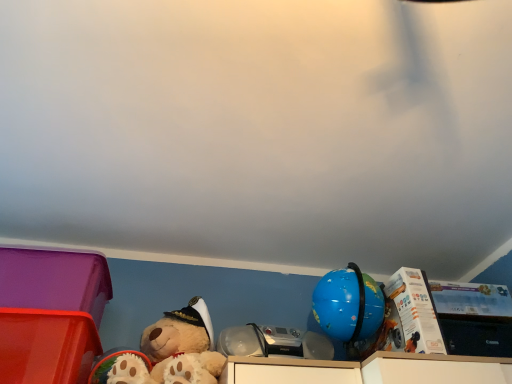
Identify the location of fluffy beige teddy bear at lower left. Image resolution: width=512 pixels, height=384 pixels. (174, 350).

What do you see at coordinates (474, 318) in the screenshot?
I see `white cardboard box at upper right, acting as the 1th storage box starting from the right` at bounding box center [474, 318].

Locate an element on the screen. fluffy beige teddy bear at lower left is located at coordinates (174, 350).

Is fluffy beige teddy bear at lower left wider than matte plastic storage box at lower left, the 1th storage box viewed from the left?

Yes.

Considering the sizes of objects fluffy beige teddy bear at lower left and matte plastic storage box at lower left, placed as the 3th storage box when sorted from right to left, in the image provided, who is smaller, fluffy beige teddy bear at lower left or matte plastic storage box at lower left, placed as the 3th storage box when sorted from right to left,?

matte plastic storage box at lower left, placed as the 3th storage box when sorted from right to left.

Is fluffy beige teddy bear at lower left closer to the viewer compared to matte plastic storage box at lower left, placed as the 3th storage box when sorted from right to left?

That is True.

Is white cardboard box at upper right, the 3th storage box viewed from the left, thinner than fluffy beige teddy bear at lower left?

Yes, white cardboard box at upper right, the 3th storage box viewed from the left, is thinner than fluffy beige teddy bear at lower left.

From a real-world perspective, is white cardboard box at upper right, acting as the 1th storage box starting from the right, positioned above or below fluffy beige teddy bear at lower left?

In terms of real-world spatial position, white cardboard box at upper right, acting as the 1th storage box starting from the right, is above fluffy beige teddy bear at lower left.

Does white cardboard box at upper right, acting as the 1th storage box starting from the right, have a lesser height compared to fluffy beige teddy bear at lower left?

Yes, white cardboard box at upper right, acting as the 1th storage box starting from the right, is shorter than fluffy beige teddy bear at lower left.

Locate an element on the screen. The height and width of the screenshot is (384, 512). storage box on the right of the matte plastic storage box at lower left, which is the second storage box from left to right is located at coordinates (474, 318).

Is white cardboard box at upper right, acting as the 1th storage box starting from the right, located outside matte plastic storage box at lower left, which is the second storage box from left to right?

That's correct, white cardboard box at upper right, acting as the 1th storage box starting from the right, is outside of matte plastic storage box at lower left, which is the second storage box from left to right.

Looking at this image, does white cardboard box at upper right, acting as the 1th storage box starting from the right, have a greater width compared to matte plastic storage box at lower left, which is counted as the 2th storage box, starting from the right?

In fact, white cardboard box at upper right, acting as the 1th storage box starting from the right, might be narrower than matte plastic storage box at lower left, which is counted as the 2th storage box, starting from the right.

Is matte plastic storage box at lower left, which is the second storage box from left to right, far away from white cardboard box at upper right, the 3th storage box viewed from the left?

matte plastic storage box at lower left, which is the second storage box from left to right, is positioned a significant distance from white cardboard box at upper right, the 3th storage box viewed from the left.

Is matte plastic storage box at lower left, which is the second storage box from left to right, turned away from white cardboard box at upper right, the 3th storage box viewed from the left?

No, matte plastic storage box at lower left, which is the second storage box from left to right, is not facing the opposite direction of white cardboard box at upper right, the 3th storage box viewed from the left.

Is matte plastic storage box at lower left, which is counted as the 2th storage box, starting from the right, wider than white cardboard box at upper right, acting as the 1th storage box starting from the right?

Yes.

From the image's perspective, is matte plastic storage box at lower left, which is counted as the 2th storage box, starting from the right, beneath white cardboard box at upper right, the 3th storage box viewed from the left?

Correct, matte plastic storage box at lower left, which is counted as the 2th storage box, starting from the right, appears lower than white cardboard box at upper right, the 3th storage box viewed from the left, in the image.

Measure the distance from matte plastic storage box at lower left, which is counted as the 2th storage box, starting from the right, to matte plastic storage box at lower left, placed as the 3th storage box when sorted from right to left.

A distance of 4.10 inches exists between matte plastic storage box at lower left, which is counted as the 2th storage box, starting from the right, and matte plastic storage box at lower left, placed as the 3th storage box when sorted from right to left.

Is matte plastic storage box at lower left, which is the second storage box from left to right, wider than matte plastic storage box at lower left, placed as the 3th storage box when sorted from right to left?

Yes.

Could you tell me if matte plastic storage box at lower left, which is the second storage box from left to right, is turned towards matte plastic storage box at lower left, the 1th storage box viewed from the left?

No, matte plastic storage box at lower left, which is the second storage box from left to right, is not aimed at matte plastic storage box at lower left, the 1th storage box viewed from the left.

Between matte plastic storage box at lower left, which is counted as the 2th storage box, starting from the right, and matte plastic storage box at lower left, the 1th storage box viewed from the left, which one has larger size?

Bigger between the two is matte plastic storage box at lower left, the 1th storage box viewed from the left.

From the image's perspective, is matte plastic storage box at lower left, which is counted as the 2th storage box, starting from the right, on fluffy beige teddy bear at lower left?

No, from the image's perspective, matte plastic storage box at lower left, which is counted as the 2th storage box, starting from the right, is not over fluffy beige teddy bear at lower left.

Is matte plastic storage box at lower left, which is the second storage box from left to right, with fluffy beige teddy bear at lower left?

They are not placed beside each other.

How much distance is there between matte plastic storage box at lower left, which is counted as the 2th storage box, starting from the right, and fluffy beige teddy bear at lower left?

They are 9.61 inches apart.

Is matte plastic storage box at lower left, which is counted as the 2th storage box, starting from the right, oriented towards fluffy beige teddy bear at lower left?

No, matte plastic storage box at lower left, which is counted as the 2th storage box, starting from the right, is not facing towards fluffy beige teddy bear at lower left.

Considering the relative positions of matte plastic storage box at lower left, the 1th storage box viewed from the left, and matte plastic storage box at lower left, which is the second storage box from left to right, in the image provided, is matte plastic storage box at lower left, the 1th storage box viewed from the left, to the right of matte plastic storage box at lower left, which is the second storage box from left to right, from the viewer's perspective?

No, matte plastic storage box at lower left, the 1th storage box viewed from the left, is not to the right of matte plastic storage box at lower left, which is the second storage box from left to right.

Where is `storage box in front of the matte plastic storage box at lower left, placed as the 3th storage box when sorted from right to left`? Image resolution: width=512 pixels, height=384 pixels. storage box in front of the matte plastic storage box at lower left, placed as the 3th storage box when sorted from right to left is located at coordinates (46, 346).

From the image's perspective, is matte plastic storage box at lower left, the 1th storage box viewed from the left, over matte plastic storage box at lower left, which is the second storage box from left to right?

Yes, from the image's perspective, matte plastic storage box at lower left, the 1th storage box viewed from the left, is on top of matte plastic storage box at lower left, which is the second storage box from left to right.

Which is correct: matte plastic storage box at lower left, placed as the 3th storage box when sorted from right to left, is inside matte plastic storage box at lower left, which is counted as the 2th storage box, starting from the right, or outside of it?

matte plastic storage box at lower left, placed as the 3th storage box when sorted from right to left, cannot be found inside matte plastic storage box at lower left, which is counted as the 2th storage box, starting from the right.

Image resolution: width=512 pixels, height=384 pixels. In order to click on teddy bear on the right of matte plastic storage box at lower left, the 1th storage box viewed from the left in this screenshot , I will do `click(174, 350)`.

Find the location of a particular element. This screenshot has height=384, width=512. teddy bear that appears below the white cardboard box at upper right, the 3th storage box viewed from the left (from the image's perspective) is located at coordinates (174, 350).

Considering their positions, is fluffy beige teddy bear at lower left positioned closer to matte plastic storage box at lower left, which is the second storage box from left to right, than matte plastic storage box at lower left, the 1th storage box viewed from the left?

matte plastic storage box at lower left, the 1th storage box viewed from the left, is closer to matte plastic storage box at lower left, which is the second storage box from left to right.

Considering their positions, is matte plastic storage box at lower left, which is the second storage box from left to right, positioned closer to fluffy beige teddy bear at lower left than matte plastic storage box at lower left, the 1th storage box viewed from the left?

Among the two, matte plastic storage box at lower left, which is the second storage box from left to right, is located nearer to fluffy beige teddy bear at lower left.

When comparing their distances from matte plastic storage box at lower left, the 1th storage box viewed from the left, does fluffy beige teddy bear at lower left or white cardboard box at upper right, acting as the 1th storage box starting from the right, seem closer?

Among the two, fluffy beige teddy bear at lower left is located nearer to matte plastic storage box at lower left, the 1th storage box viewed from the left.

Estimate the real-world distances between objects in this image. Which object is closer to fluffy beige teddy bear at lower left, matte plastic storage box at lower left, placed as the 3th storage box when sorted from right to left, or white cardboard box at upper right, acting as the 1th storage box starting from the right?

matte plastic storage box at lower left, placed as the 3th storage box when sorted from right to left, is positioned closer to the anchor fluffy beige teddy bear at lower left.

When comparing their distances from matte plastic storage box at lower left, the 1th storage box viewed from the left, does matte plastic storage box at lower left, which is the second storage box from left to right, or white cardboard box at upper right, the 3th storage box viewed from the left, seem closer?

matte plastic storage box at lower left, which is the second storage box from left to right, lies closer to matte plastic storage box at lower left, the 1th storage box viewed from the left, than the other object.

Which object lies further to the anchor point white cardboard box at upper right, the 3th storage box viewed from the left, fluffy beige teddy bear at lower left or matte plastic storage box at lower left, which is the second storage box from left to right?

Based on the image, matte plastic storage box at lower left, which is the second storage box from left to right, appears to be further to white cardboard box at upper right, the 3th storage box viewed from the left.

Considering their positions, is white cardboard box at upper right, the 3th storage box viewed from the left, positioned closer to fluffy beige teddy bear at lower left than matte plastic storage box at lower left, placed as the 3th storage box when sorted from right to left?

matte plastic storage box at lower left, placed as the 3th storage box when sorted from right to left, is closer to fluffy beige teddy bear at lower left.

When comparing their distances from matte plastic storage box at lower left, placed as the 3th storage box when sorted from right to left, does white cardboard box at upper right, the 3th storage box viewed from the left, or matte plastic storage box at lower left, which is the second storage box from left to right, seem closer?

Among the two, matte plastic storage box at lower left, which is the second storage box from left to right, is located nearer to matte plastic storage box at lower left, placed as the 3th storage box when sorted from right to left.

Find the location of `storage box located between matte plastic storage box at lower left, the 1th storage box viewed from the left, and white cardboard box at upper right, the 3th storage box viewed from the left, in the left-right direction`. storage box located between matte plastic storage box at lower left, the 1th storage box viewed from the left, and white cardboard box at upper right, the 3th storage box viewed from the left, in the left-right direction is located at coordinates (46, 346).

The height and width of the screenshot is (384, 512). I want to click on teddy bear between matte plastic storage box at lower left, the 1th storage box viewed from the left, and white cardboard box at upper right, the 3th storage box viewed from the left, from left to right, so click(174, 350).

I want to click on storage box between matte plastic storage box at lower left, the 1th storage box viewed from the left, and fluffy beige teddy bear at lower left, in the horizontal direction, so click(x=46, y=346).

Find the location of a particular element. This screenshot has height=384, width=512. teddy bear between matte plastic storage box at lower left, which is counted as the 2th storage box, starting from the right, and white cardboard box at upper right, acting as the 1th storage box starting from the right is located at coordinates (174, 350).